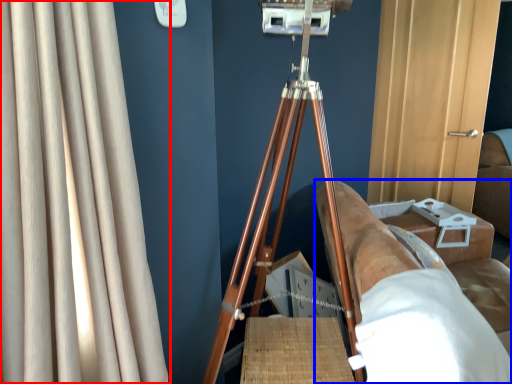
Question: Which of the following is the closest to the observer, curtain (highlighted by a red box) or furniture (highlighted by a blue box)?

Choices:
 (A) curtain
 (B) furniture

Answer: (A)